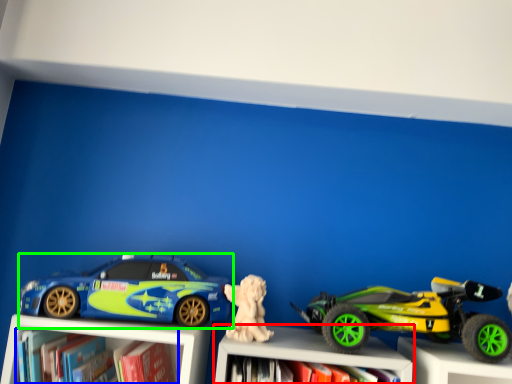
Question: Which is nearer to the bookcase (highlighted by a red box)? book (highlighted by a blue box) or car (highlighted by a green box).

Choices:
 (A) book
 (B) car

Answer: (B)